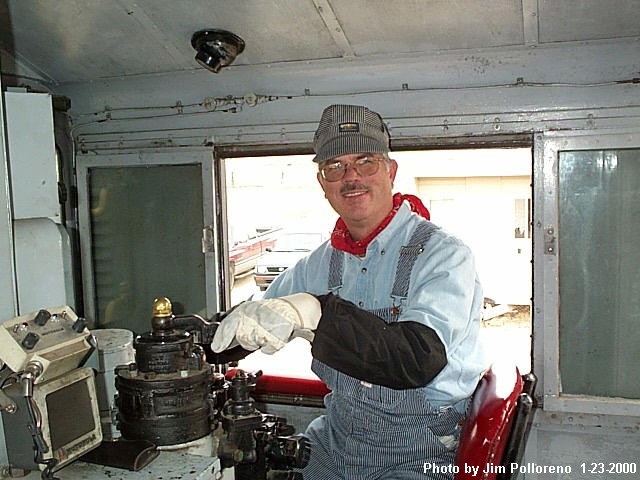
Find the location of a particular element. This screenshot has height=480, width=640. black knobs is located at coordinates (29, 347), (43, 314), (80, 323).